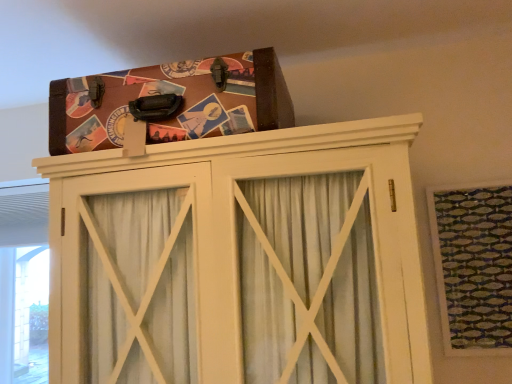
Question: From the image's perspective, is wooden cabinet at upper center located above green textured fabric at upper right?

Choices:
 (A) yes
 (B) no

Answer: (B)

Question: Considering the relative sizes of wooden cabinet at upper center and green textured fabric at upper right in the image provided, is wooden cabinet at upper center thinner than green textured fabric at upper right?

Choices:
 (A) yes
 (B) no

Answer: (B)

Question: From a real-world perspective, is wooden cabinet at upper center physically above green textured fabric at upper right?

Choices:
 (A) no
 (B) yes

Answer: (B)

Question: Is wooden cabinet at upper center at the left side of green textured fabric at upper right?

Choices:
 (A) yes
 (B) no

Answer: (A)

Question: Considering the relative sizes of wooden cabinet at upper center and green textured fabric at upper right in the image provided, is wooden cabinet at upper center smaller than green textured fabric at upper right?

Choices:
 (A) no
 (B) yes

Answer: (A)

Question: Could you tell me if wooden cabinet at upper center is turned towards green textured fabric at upper right?

Choices:
 (A) no
 (B) yes

Answer: (A)

Question: From a real-world perspective, is wooden cabinet at upper center physically above brown leather suitcase at upper center?

Choices:
 (A) yes
 (B) no

Answer: (B)

Question: Could brown leather suitcase at upper center be considered to be inside wooden cabinet at upper center?

Choices:
 (A) yes
 (B) no

Answer: (B)

Question: Is wooden cabinet at upper center to the left of brown leather suitcase at upper center from the viewer's perspective?

Choices:
 (A) yes
 (B) no

Answer: (B)

Question: Is wooden cabinet at upper center facing away from brown leather suitcase at upper center?

Choices:
 (A) yes
 (B) no

Answer: (B)

Question: From the image's perspective, is wooden cabinet at upper center above brown leather suitcase at upper center?

Choices:
 (A) yes
 (B) no

Answer: (B)

Question: Considering the relative sizes of wooden cabinet at upper center and brown leather suitcase at upper center in the image provided, is wooden cabinet at upper center wider than brown leather suitcase at upper center?

Choices:
 (A) no
 (B) yes

Answer: (B)

Question: From the image's perspective, is green textured fabric at upper right under wooden cabinet at upper center?

Choices:
 (A) yes
 (B) no

Answer: (B)